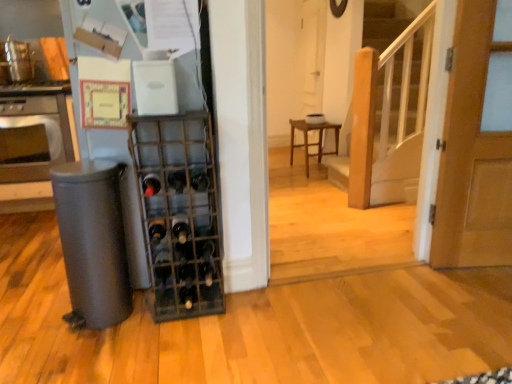
Locate an element on the screen. The width and height of the screenshot is (512, 384). free space above white matte switch at upper center, which ranks as the second appliance in bottom-to-top order (from a real-world perspective) is located at coordinates (151, 62).